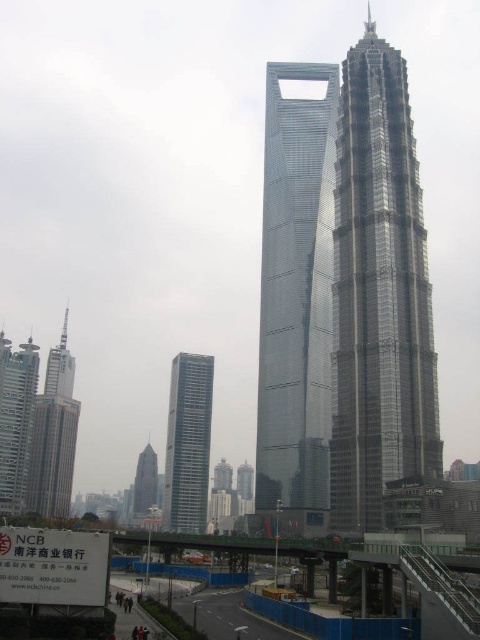
Between silver glass skyscraper at left and matte brown skyscraper at center, which one has less height?

matte brown skyscraper at center is shorter.

Locate an element on the screen. silver glass skyscraper at left is located at coordinates (15, 419).

Does gold reflective tower at left come in front of silver glass skyscraper at left?

No.

Looking at this image, does gold reflective tower at left have a greater height compared to silver glass skyscraper at left?

Yes.

Who is more forward, (55, 408) or (32, 397)?

Positioned in front is point (32, 397).

Identify the location of gold reflective tower at left. This screenshot has height=640, width=480. (54, 435).

From the picture: Can you confirm if silver glass skyscraper at left is smaller than smooth asphalt highway at lower center?

No, silver glass skyscraper at left is not smaller than smooth asphalt highway at lower center.

Is point (0, 465) positioned in front of point (250, 612)?

No, it is not.

Identify the location of silver glass skyscraper at left. (15, 419).

This screenshot has height=640, width=480. In order to click on silver glass skyscraper at left in this screenshot , I will do `click(15, 419)`.